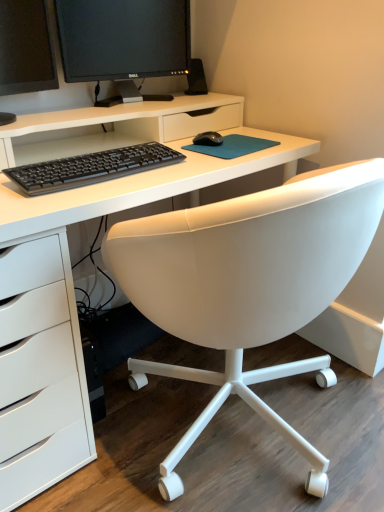
This screenshot has height=512, width=384. What do you see at coordinates (123, 39) in the screenshot?
I see `black glossy monitor at upper center, which is the 1th computer monitor from right to left` at bounding box center [123, 39].

I want to click on black glossy monitor at upper center, which is the 1th computer monitor from right to left, so click(x=123, y=39).

Is black matte mouse at center at the back of black glossy monitor at upper center, the 2th computer monitor when ordered from left to right?

No, black matte mouse at center is not at the back of black glossy monitor at upper center, the 2th computer monitor when ordered from left to right.

What's the angular difference between black glossy monitor at upper center, which is the 1th computer monitor from right to left, and black matte mouse at center's facing directions?

The facing directions of black glossy monitor at upper center, which is the 1th computer monitor from right to left, and black matte mouse at center are 32.4 degrees apart.

Is black glossy monitor at upper center, which is the 1th computer monitor from right to left, at the right side of black matte mouse at center?

Incorrect, black glossy monitor at upper center, which is the 1th computer monitor from right to left, is not on the right side of black matte mouse at center.

Considering the sizes of black glossy monitor at upper center, which is the 1th computer monitor from right to left, and black matte mouse at center in the image, is black glossy monitor at upper center, which is the 1th computer monitor from right to left, taller or shorter than black matte mouse at center?

In the image, black glossy monitor at upper center, which is the 1th computer monitor from right to left, appears to be taller than black matte mouse at center.

Are black matte keyboard at center and black glossy monitor at upper center, the 2th computer monitor when ordered from left to right, far apart?

That's not correct — black matte keyboard at center is a little close to black glossy monitor at upper center, the 2th computer monitor when ordered from left to right.

Which is more to the right, black matte keyboard at center or black glossy monitor at upper center, the 2th computer monitor when ordered from left to right?

From the viewer's perspective, black glossy monitor at upper center, the 2th computer monitor when ordered from left to right, appears more on the right side.

Can you tell me how much black matte keyboard at center and black glossy monitor at upper center, the 2th computer monitor when ordered from left to right, differ in facing direction?

They differ by 11.1 degrees in their facing directions.

Who is bigger, black matte keyboard at center or black glossy monitor at upper center, which is the 1th computer monitor from right to left?

With larger size is black glossy monitor at upper center, which is the 1th computer monitor from right to left.

Is white matte desk at center next to black glossy monitor at upper left, placed as the first computer monitor when sorted from left to right?

No, white matte desk at center is not touching black glossy monitor at upper left, placed as the first computer monitor when sorted from left to right.

Locate an element on the screen. desk below the black glossy monitor at upper left, arranged as the second computer monitor when viewed from the right (from the image's perspective) is located at coordinates (70, 262).

Between white matte desk at center and black glossy monitor at upper left, arranged as the second computer monitor when viewed from the right, which one has smaller width?

With smaller width is black glossy monitor at upper left, arranged as the second computer monitor when viewed from the right.

From the image's perspective, would you say white matte desk at center is shown under black glossy monitor at upper left, placed as the first computer monitor when sorted from left to right?

Yes, from the image's perspective, white matte desk at center is beneath black glossy monitor at upper left, placed as the first computer monitor when sorted from left to right.

Would you consider black matte keyboard at center to be distant from white matte desk at center?

black matte keyboard at center is actually quite close to white matte desk at center.

From the image's perspective, which is below, black matte keyboard at center or white matte desk at center?

white matte desk at center.

Which object is closer to the camera, black matte keyboard at center or white matte desk at center?

white matte desk at center is more forward.

From a real-world perspective, between black matte keyboard at center and white matte desk at center, who is vertically higher?

black matte keyboard at center.

From the image's perspective, would you say black glossy monitor at upper center, the 2th computer monitor when ordered from left to right, is shown under black glossy monitor at upper left, placed as the first computer monitor when sorted from left to right?

Actually, black glossy monitor at upper center, the 2th computer monitor when ordered from left to right, appears above black glossy monitor at upper left, placed as the first computer monitor when sorted from left to right, in the image.

Who is smaller, black glossy monitor at upper center, the 2th computer monitor when ordered from left to right, or black glossy monitor at upper left, placed as the first computer monitor when sorted from left to right?

Smaller between the two is black glossy monitor at upper center, the 2th computer monitor when ordered from left to right.

In the scene shown: Considering the relative positions of black glossy monitor at upper center, the 2th computer monitor when ordered from left to right, and black glossy monitor at upper left, arranged as the second computer monitor when viewed from the right, in the image provided, is black glossy monitor at upper center, the 2th computer monitor when ordered from left to right, behind black glossy monitor at upper left, arranged as the second computer monitor when viewed from the right,?

Yes, it is behind black glossy monitor at upper left, arranged as the second computer monitor when viewed from the right.

Between black glossy monitor at upper center, the 2th computer monitor when ordered from left to right, and black glossy monitor at upper left, placed as the first computer monitor when sorted from left to right, which one has more height?

black glossy monitor at upper center, the 2th computer monitor when ordered from left to right.

Is black matte mouse at center in front of or behind black matte keyboard at center in the image?

black matte mouse at center is behind black matte keyboard at center.

Is black matte mouse at center at the left side of black matte keyboard at center?

Incorrect, black matte mouse at center is not on the left side of black matte keyboard at center.

Is black matte mouse at center taller than black matte keyboard at center?

No.

Which object is wider, black matte mouse at center or black matte keyboard at center?

black matte keyboard at center.

Does black matte keyboard at center contain black matte mouse at center?

No, black matte mouse at center is located outside of black matte keyboard at center.

Does black matte keyboard at center have a lesser width compared to black matte mouse at center?

In fact, black matte keyboard at center might be wider than black matte mouse at center.

Considering the relative positions of black matte keyboard at center and black matte mouse at center in the image provided, is black matte keyboard at center to the left of black matte mouse at center from the viewer's perspective?

Indeed, black matte keyboard at center is positioned on the left side of black matte mouse at center.

You are a GUI agent. You are given a task and a screenshot of the screen. Output one action in this format:
    pyautogui.click(x=<x>, y=<y>)
    Task: Click on the mouse above the black matte keyboard at center (from a real-world perspective)
    
    Given the screenshot: What is the action you would take?
    pyautogui.click(x=208, y=139)

Locate an element on the screen. The width and height of the screenshot is (384, 512). computer monitor that is the 2nd one above the black matte mouse at center (from a real-world perspective) is located at coordinates (123, 39).

The width and height of the screenshot is (384, 512). Find the location of `computer keyboard on the left of the black glossy monitor at upper center, which is the 1th computer monitor from right to left`. computer keyboard on the left of the black glossy monitor at upper center, which is the 1th computer monitor from right to left is located at coordinates (91, 168).

From the image, which object appears to be farther from black glossy monitor at upper center, the 2th computer monitor when ordered from left to right, black matte keyboard at center or black glossy monitor at upper left, arranged as the second computer monitor when viewed from the right?

Among the two, black matte keyboard at center is located further to black glossy monitor at upper center, the 2th computer monitor when ordered from left to right.

Estimate the real-world distances between objects in this image. Which object is further from black matte mouse at center, black glossy monitor at upper center, which is the 1th computer monitor from right to left, or black plastic speaker at upper center?

Based on the image, black glossy monitor at upper center, which is the 1th computer monitor from right to left, appears to be further to black matte mouse at center.

Based on their spatial positions, is black glossy monitor at upper left, placed as the first computer monitor when sorted from left to right, or black glossy monitor at upper center, the 2th computer monitor when ordered from left to right, further from black plastic speaker at upper center?

The object further to black plastic speaker at upper center is black glossy monitor at upper left, placed as the first computer monitor when sorted from left to right.

When comparing their distances from white matte desk at center, does black glossy monitor at upper left, arranged as the second computer monitor when viewed from the right, or black glossy monitor at upper center, which is the 1th computer monitor from right to left, seem closer?

black glossy monitor at upper center, which is the 1th computer monitor from right to left, is closer to white matte desk at center.

Based on the photo, considering their positions, is black matte keyboard at center positioned further to white matte desk at center than black glossy monitor at upper left, arranged as the second computer monitor when viewed from the right?

→ black glossy monitor at upper left, arranged as the second computer monitor when viewed from the right, is further to white matte desk at center.

From the image, which object appears to be farther from black matte mouse at center, black plastic speaker at upper center or black matte keyboard at center?

black matte keyboard at center.

Based on the photo, when comparing their distances from white matte desk at center, does black plastic speaker at upper center or black glossy monitor at upper center, the 2th computer monitor when ordered from left to right, seem closer?

black glossy monitor at upper center, the 2th computer monitor when ordered from left to right, is positioned closer to the anchor white matte desk at center.

Which object lies further to the anchor point black matte keyboard at center, black glossy monitor at upper left, arranged as the second computer monitor when viewed from the right, or black plastic speaker at upper center?

Based on the image, black plastic speaker at upper center appears to be further to black matte keyboard at center.

At what (x,y) coordinates should I click in order to perform the action: click on mouse between black glossy monitor at upper center, which is the 1th computer monitor from right to left, and black matte keyboard at center from top to bottom. Please return your answer as a coordinate pair (x, y). This screenshot has height=512, width=384. Looking at the image, I should click on pos(208,139).

Identify the location of computer keyboard positioned between white matte desk at center and black matte mouse at center from near to far. (91, 168).

Where is `computer keyboard that lies between black glossy monitor at upper left, arranged as the second computer monitor when viewed from the right, and white matte desk at center from top to bottom`? This screenshot has width=384, height=512. computer keyboard that lies between black glossy monitor at upper left, arranged as the second computer monitor when viewed from the right, and white matte desk at center from top to bottom is located at coordinates (91, 168).

Where is `computer keyboard between white matte desk at center and black plastic speaker at upper center from front to back`? The width and height of the screenshot is (384, 512). computer keyboard between white matte desk at center and black plastic speaker at upper center from front to back is located at coordinates (91, 168).